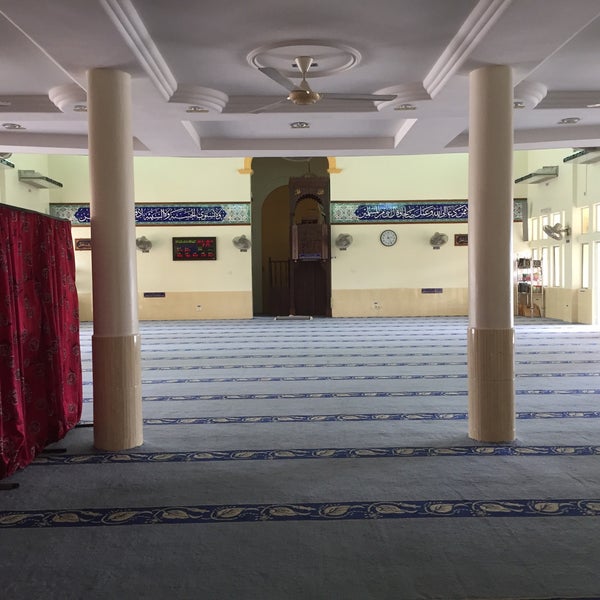
In order to click on ceiling in this screenshot , I will do `click(236, 63)`.